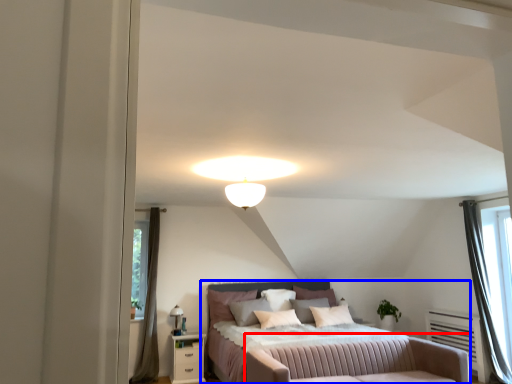
Question: Which point is further to the camera, swivel chair (highlighted by a red box) or bed (highlighted by a blue box)?

Choices:
 (A) swivel chair
 (B) bed

Answer: (B)